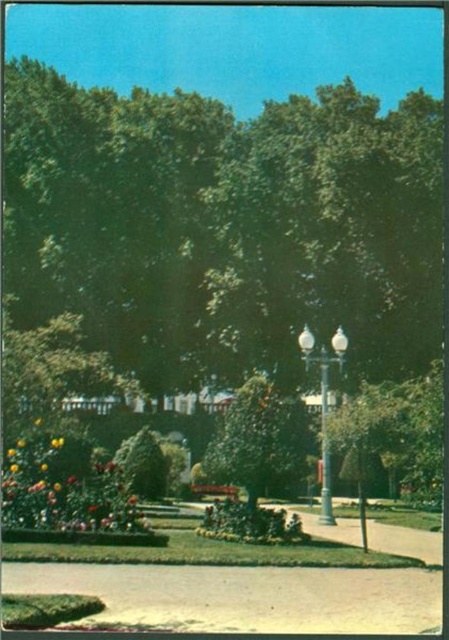
You are a gardener who needs to water both the green leafy tree at center and the green leafy bush at center. Which one should you water first if you want to start with the one closer to you?

You should water the green leafy tree at center first because it is closer to you than the green leafy bush at center, which is positioned behind it.

You are a gardener planning to plant a new tree that requires a space of 3 meters in width. You see the green leafy tree at center and the yellow matte flower at lower left in the park. Which one do you think would need more space between them to accommodate the new tree?

The green leafy tree at center has a larger width than the yellow matte flower at lower left, so it would require more space between them to accommodate the new tree that needs 3 meters in width.

You are a gardener who needs to water both the green leafy tree at center and the glossy yellow flower at center. You have a watering can that can hold enough water to cover a 50 feet radius. Starting from the path, can you reach both plants without needing to refill your watering can?

The green leafy tree at center and the glossy yellow flower at center are 67.18 feet apart from each other. Since the watering can covers a 50 feet radius, the distance between them exceeds the coverage. Therefore, you will need to refill your watering can to water both plants.